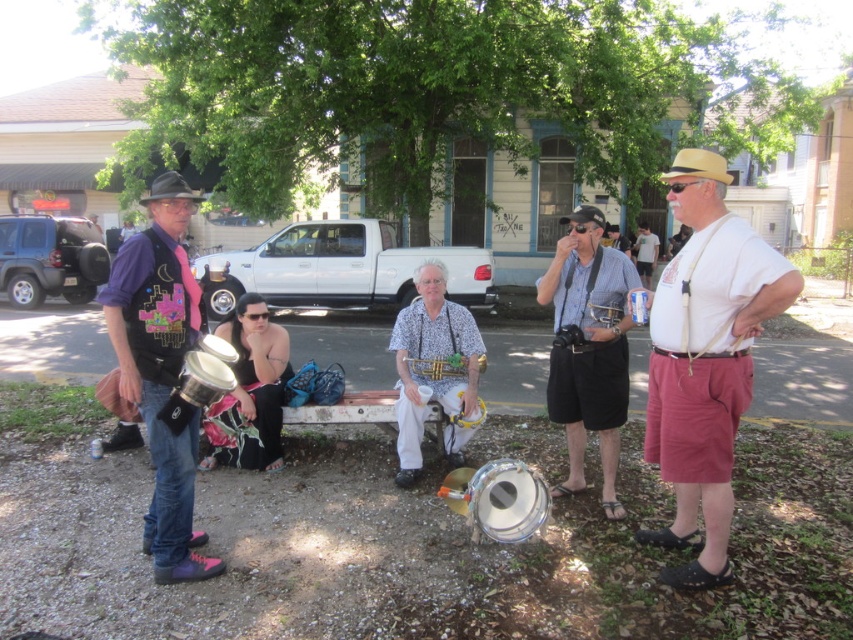
Does white cotton shirt at right appear on the right side of black felt cowboy hat at left?

Yes, white cotton shirt at right is to the right of black felt cowboy hat at left.

Who is higher up, white cotton shirt at right or black felt cowboy hat at left?

black felt cowboy hat at left is higher up.

Identify the location of white cotton shirt at right. (705, 368).

Identify the location of white cotton shirt at right. The height and width of the screenshot is (640, 853). tap(705, 368).

In the scene shown: Can you confirm if silver metallic drum at lower center is positioned to the left of tan straw cowboy hat at upper center?

Yes, silver metallic drum at lower center is to the left of tan straw cowboy hat at upper center.

Where is `silver metallic drum at lower center`? silver metallic drum at lower center is located at coordinates (498, 499).

Does black leather shorts at center appear under gold brass trumpet at center?

No, black leather shorts at center is not below gold brass trumpet at center.

Is point (621, 356) closer to viewer compared to point (431, 362)?

Yes, point (621, 356) is closer to viewer.

Where is `black leather shorts at center`? This screenshot has height=640, width=853. black leather shorts at center is located at coordinates (589, 348).